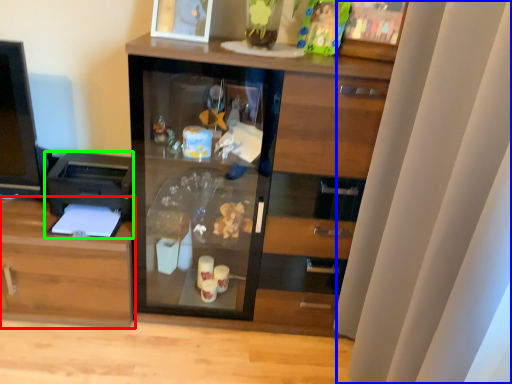
Question: Estimate the real-world distances between objects in this image. Which object is farther from cabinetry (highlighted by a red box), curtain (highlighted by a blue box) or printer (highlighted by a green box)?

Choices:
 (A) curtain
 (B) printer

Answer: (A)